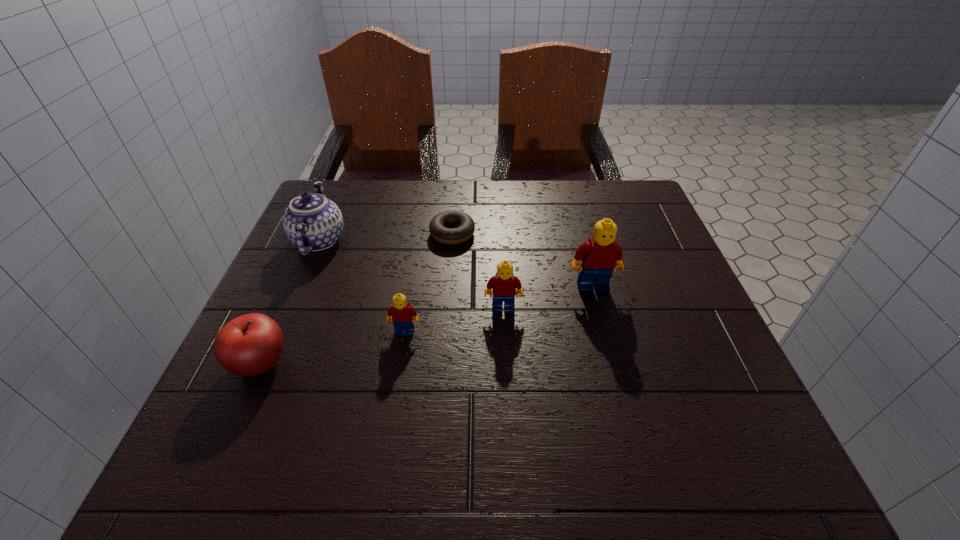
Where is `object that is at the right edge`? This screenshot has height=540, width=960. object that is at the right edge is located at coordinates [x=601, y=255].

I want to click on object present at the far left corner, so click(x=312, y=222).

Find the location of a particular element. The width and height of the screenshot is (960, 540). object positioned at the near left corner is located at coordinates (251, 344).

In the image, there is a desktop. Where is `free region at the far edge`? This screenshot has width=960, height=540. free region at the far edge is located at coordinates (400, 192).

The height and width of the screenshot is (540, 960). In the image, there is a desktop. Identify the location of vacant region at the near edge. (444, 382).

At what (x,y) coordinates should I click in order to perform the action: click on free region at the left edge. Please return your answer as a coordinate pair (x, y). The width and height of the screenshot is (960, 540). Looking at the image, I should click on (285, 328).

Where is `free spot at the right edge of the desktop`? free spot at the right edge of the desktop is located at coordinates (704, 347).

Where is `vacant region at the near left corner of the desktop`? The width and height of the screenshot is (960, 540). vacant region at the near left corner of the desktop is located at coordinates (283, 382).

Where is `unoccupied position between the chinaware and the second tallest Lego`? This screenshot has width=960, height=540. unoccupied position between the chinaware and the second tallest Lego is located at coordinates (411, 274).

Find the location of a particular element. Image resolution: width=960 pixels, height=540 pixels. free space between the apple and the farthest Lego is located at coordinates (426, 325).